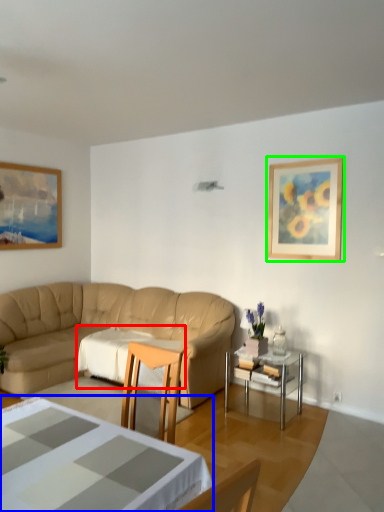
Question: Which object is positioned closest to tablecloth (highlighted by a red box)? Select from coffee table (highlighted by a blue box) and picture frame (highlighted by a green box).

Choices:
 (A) coffee table
 (B) picture frame

Answer: (B)